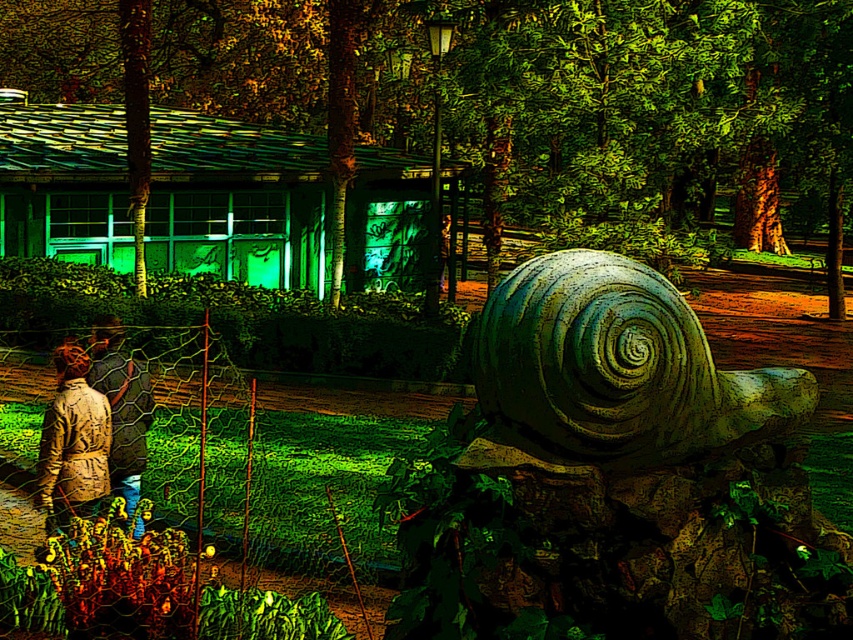
You are standing in the surreal scene and want to place a small decorative rock. You have two points to choose from. The first point is at coordinate point(521, 330) and the second is at point(112, 410). Which point is closer to you?

Point(521, 330) is closer to the viewer than point(112, 410), so you should place the decorative rock there.